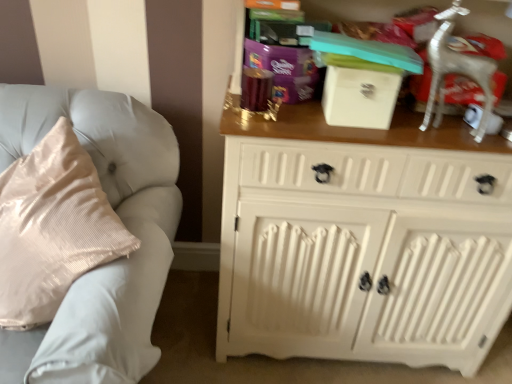
Question: From the image's perspective, would you say light gray fabric couch at left is positioned over silver metallic deer at upper right?

Choices:
 (A) no
 (B) yes

Answer: (A)

Question: Does light gray fabric couch at left have a lesser height compared to silver metallic deer at upper right?

Choices:
 (A) yes
 (B) no

Answer: (B)

Question: Is light gray fabric couch at left with silver metallic deer at upper right?

Choices:
 (A) no
 (B) yes

Answer: (A)

Question: Could you tell me if light gray fabric couch at left is turned towards silver metallic deer at upper right?

Choices:
 (A) yes
 (B) no

Answer: (B)

Question: From a real-world perspective, is light gray fabric couch at left physically above silver metallic deer at upper right?

Choices:
 (A) yes
 (B) no

Answer: (B)

Question: Does light gray fabric couch at left have a smaller size compared to silver metallic deer at upper right?

Choices:
 (A) no
 (B) yes

Answer: (A)

Question: Is white painted wood cabinet at right taller than purple glossy gift at upper center?

Choices:
 (A) yes
 (B) no

Answer: (A)

Question: Does white painted wood cabinet at right appear on the left side of purple glossy gift at upper center?

Choices:
 (A) yes
 (B) no

Answer: (B)

Question: Is the depth of white painted wood cabinet at right greater than that of purple glossy gift at upper center?

Choices:
 (A) yes
 (B) no

Answer: (B)

Question: Considering the relative positions of white painted wood cabinet at right and purple glossy gift at upper center in the image provided, is white painted wood cabinet at right to the right of purple glossy gift at upper center from the viewer's perspective?

Choices:
 (A) yes
 (B) no

Answer: (A)

Question: From a real-world perspective, is white painted wood cabinet at right on top of purple glossy gift at upper center?

Choices:
 (A) no
 (B) yes

Answer: (A)

Question: From the image's perspective, is white painted wood cabinet at right beneath purple glossy gift at upper center?

Choices:
 (A) yes
 (B) no

Answer: (A)

Question: Is silver metallic deer at upper right surrounded by white painted wood cabinet at right?

Choices:
 (A) no
 (B) yes

Answer: (B)